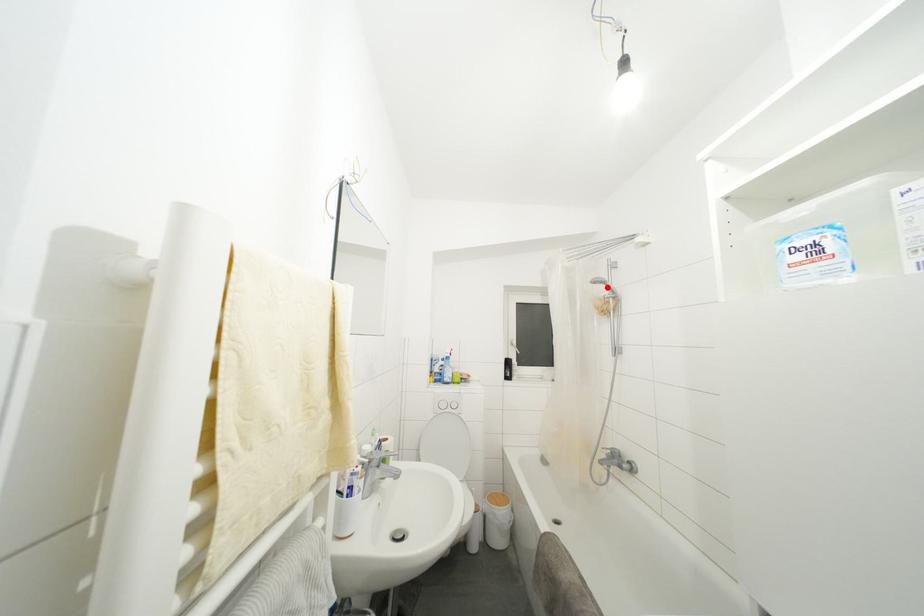
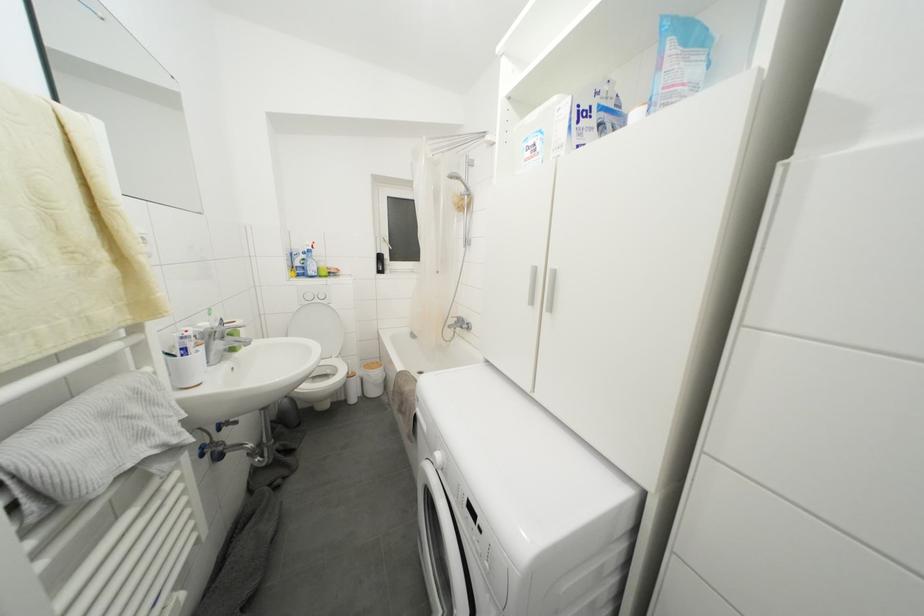
Question: I am providing you with two images of the same scene from different viewpoints. Given a red point in image1, look at the same physical point in image2. Is it:

Choices:
 (A) Closer to the viewpoint
 (B) Farther from the viewpoint

Answer: (A)